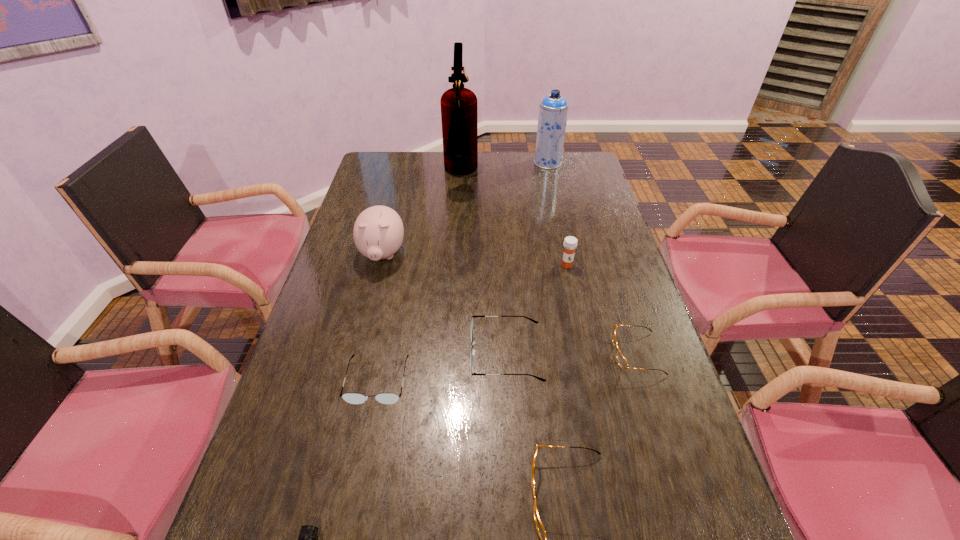
At what (x,y) coordinates should I click in order to perform the action: click on the rightmost spectacles. Please return your answer as a coordinate pair (x, y). The image size is (960, 540). Looking at the image, I should click on (622, 361).

Image resolution: width=960 pixels, height=540 pixels. I want to click on free space located 0.210m at the nozzle of the red fire extinguisher, so click(531, 174).

Identify the location of free location located 0.050m on the right of the eighth shortest object. (574, 163).

Locate an element on the screen. Image resolution: width=960 pixels, height=540 pixels. free space located at the snout of the seventh shortest object is located at coordinates (354, 369).

This screenshot has width=960, height=540. What are the coordinates of `vacant space positioned on the label side of the sixth shortest object` in the screenshot? It's located at (588, 359).

Locate an element on the screen. This screenshot has height=540, width=960. free space located on the lenses of the right black spectacles is located at coordinates (366, 354).

Where is `free spot located on the lenses of the right black spectacles`? free spot located on the lenses of the right black spectacles is located at coordinates (313, 354).

What are the coordinates of `vacant region located on the lenses of the right black spectacles` in the screenshot? It's located at (446, 354).

Identify the location of vacant position located on the lenses of the leftmost spectacles. (361, 463).

The width and height of the screenshot is (960, 540). Find the location of `free space located on the front-facing side of the smaller gold spectacles`. free space located on the front-facing side of the smaller gold spectacles is located at coordinates (485, 354).